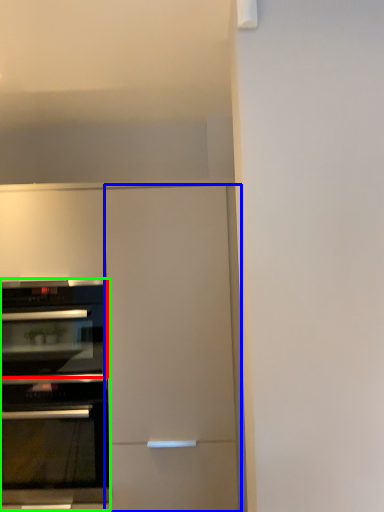
Question: Based on their relative distances, which object is nearer to oven (highlighted by a red box)? Choose from door (highlighted by a blue box) and oven (highlighted by a green box).

Choices:
 (A) door
 (B) oven

Answer: (B)